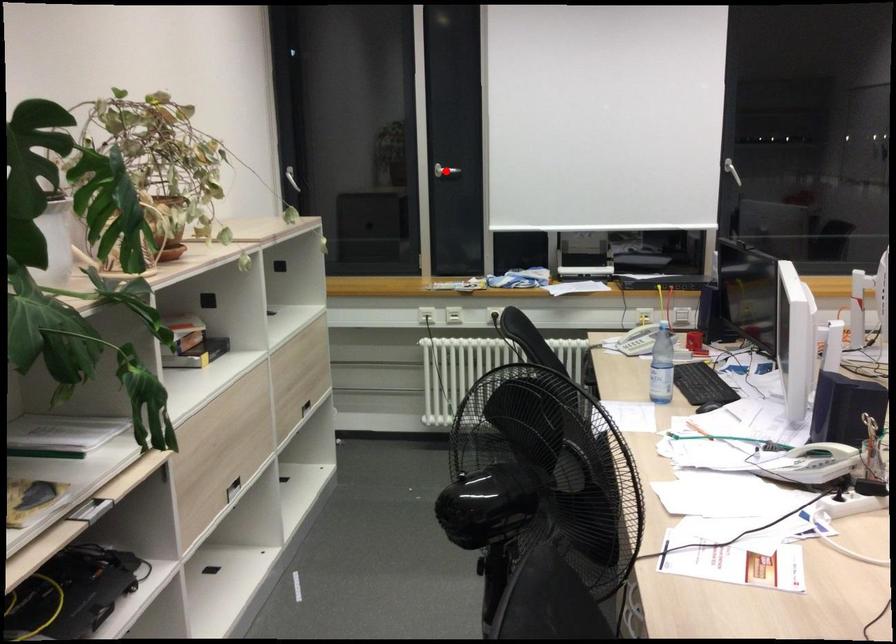
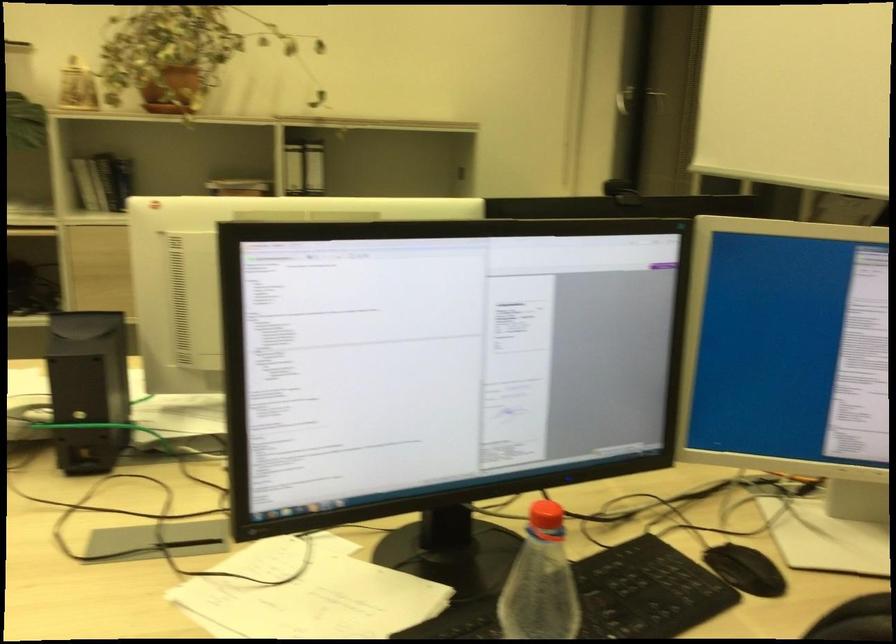
Question: I am providing you with two images of the same scene from different viewpoints. A red point is marked on the first image. Can you still see the location of the red point in image 2?

Choices:
 (A) Yes
 (B) No

Answer: (B)